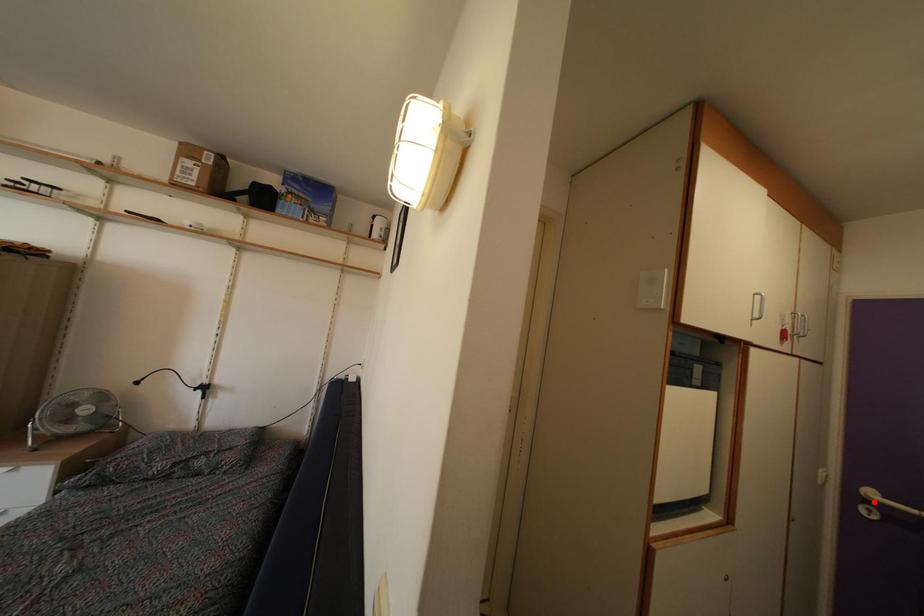
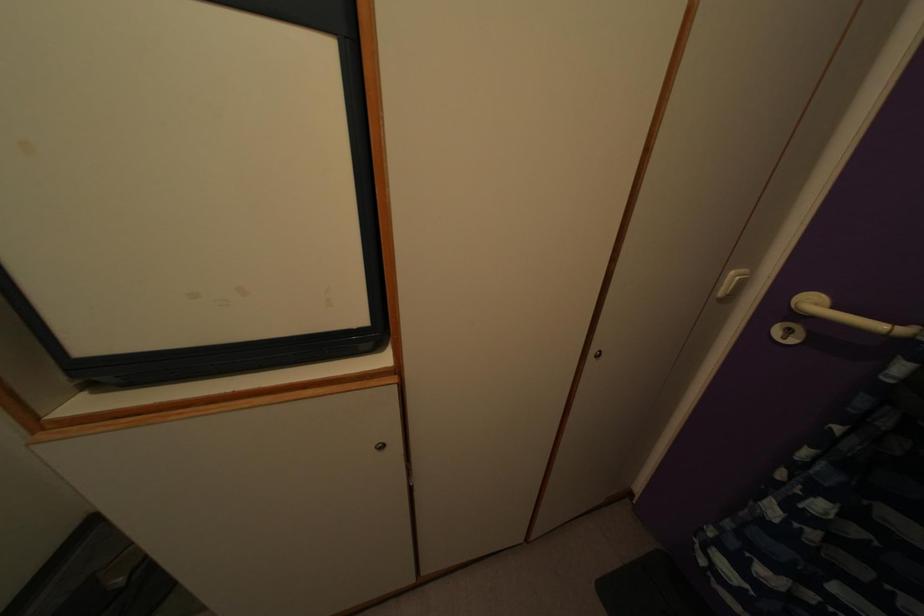
The point at the highlighted location is marked in the first image. Where is the corresponding point in the second image?

(815, 310)